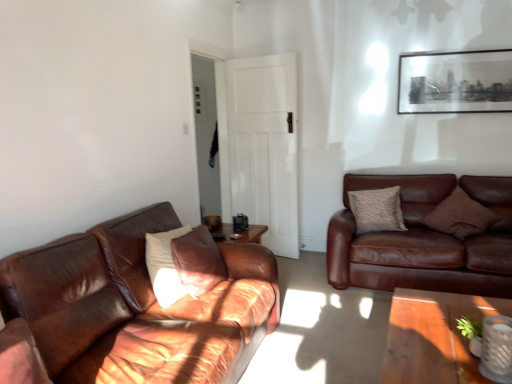
Question: Is the surface of brown textured pillow at right, which is the 3th pillow from left to right, in direct contact with white matte door at center?

Choices:
 (A) yes
 (B) no

Answer: (B)

Question: From the image's perspective, is brown textured pillow at right, the second pillow in the back-to-front sequence, on top of white matte door at center?

Choices:
 (A) yes
 (B) no

Answer: (B)

Question: Is brown textured pillow at right, which is the first pillow in right-to-left order, in front of white matte door at center?

Choices:
 (A) no
 (B) yes

Answer: (B)

Question: Is brown textured pillow at right, the second pillow in the back-to-front sequence, thinner than white matte door at center?

Choices:
 (A) yes
 (B) no

Answer: (B)

Question: From a real-world perspective, is brown textured pillow at right, which is the first pillow in right-to-left order, positioned under white matte door at center based on gravity?

Choices:
 (A) yes
 (B) no

Answer: (A)

Question: Is brown leather couch at left, which ranks as the 1th studio couch in front-to-back order, taller or shorter than white matte door at center?

Choices:
 (A) short
 (B) tall

Answer: (A)

Question: From the image's perspective, is brown leather couch at left, which ranks as the 1th studio couch in front-to-back order, located above or below white matte door at center?

Choices:
 (A) below
 (B) above

Answer: (A)

Question: In terms of width, does brown leather couch at left, the 2th studio couch viewed from the back, look wider or thinner when compared to white matte door at center?

Choices:
 (A) wide
 (B) thin

Answer: (A)

Question: Relative to white matte door at center, is brown leather couch at left, the 2th studio couch viewed from the back, in front or behind?

Choices:
 (A) front
 (B) behind

Answer: (A)

Question: Is textured brown pillow at right, placed as the second pillow when sorted from left to right, bigger or smaller than brown textured pillow at right, which is the 3th pillow from left to right?

Choices:
 (A) big
 (B) small

Answer: (B)

Question: Considering the relative positions of textured brown pillow at right, which is the 3th pillow in front-to-back order, and brown textured pillow at right, which ranks as the second pillow in front-to-back order, in the image provided, is textured brown pillow at right, which is the 3th pillow in front-to-back order, to the left or to the right of brown textured pillow at right, which ranks as the second pillow in front-to-back order,?

Choices:
 (A) right
 (B) left

Answer: (B)

Question: Is textured brown pillow at right, placed as the second pillow when sorted from left to right, inside or outside of brown textured pillow at right, which ranks as the second pillow in front-to-back order?

Choices:
 (A) outside
 (B) inside

Answer: (A)

Question: Considering the positions of textured brown pillow at right, which is the 3th pillow in front-to-back order, and brown textured pillow at right, which is the first pillow in right-to-left order, in the image, is textured brown pillow at right, which is the 3th pillow in front-to-back order, wider or thinner than brown textured pillow at right, which is the first pillow in right-to-left order,?

Choices:
 (A) thin
 (B) wide

Answer: (A)

Question: Would you say textured brown pillow at right, which is the 1th pillow from back to front, is to the left or to the right of brown leather couch at left, which ranks as the 1th studio couch in front-to-back order, in the picture?

Choices:
 (A) right
 (B) left

Answer: (A)

Question: Is textured brown pillow at right, placed as the second pillow when sorted from left to right, wider or thinner than brown leather couch at left, the 1th studio couch positioned from the left?

Choices:
 (A) wide
 (B) thin

Answer: (B)